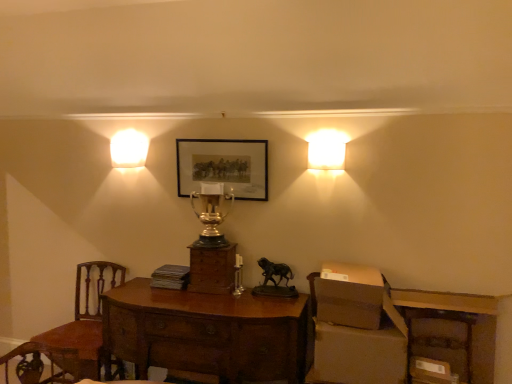
Locate an element on the screen. Image resolution: width=512 pixels, height=384 pixels. blank space situated above matte black picture frame at center (from a real-world perspective) is located at coordinates (215, 142).